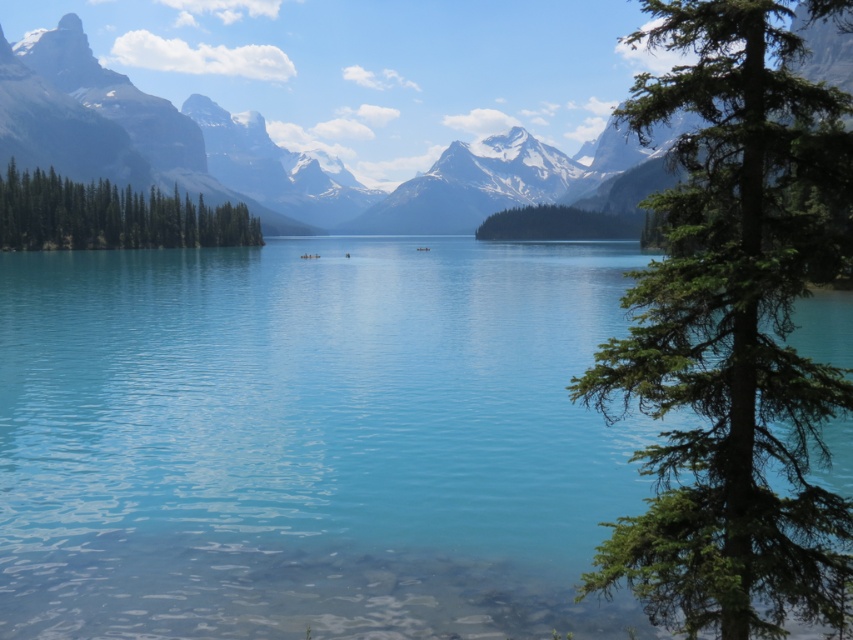
Question: Which object appears closest to the camera in this image?

Choices:
 (A) green needle-like foliage at right
 (B) clear blue water at center
 (C) green matte tree at left

Answer: (A)

Question: Which point is closer to the camera taking this photo?

Choices:
 (A) (645, 204)
 (B) (289, 177)

Answer: (A)

Question: Among these objects, which one is farthest from the camera?

Choices:
 (A) smooth granite mountain at center
 (B) green textured island at center

Answer: (B)

Question: Observing the image, what is the correct spatial positioning of green needle-like foliage at right in reference to green textured island at center?

Choices:
 (A) left
 (B) right

Answer: (A)

Question: Is clear blue water at center positioned behind smooth granite mountain at center?

Choices:
 (A) yes
 (B) no

Answer: (B)

Question: Does green needle-like foliage at right appear on the right side of green textured island at center?

Choices:
 (A) no
 (B) yes

Answer: (A)